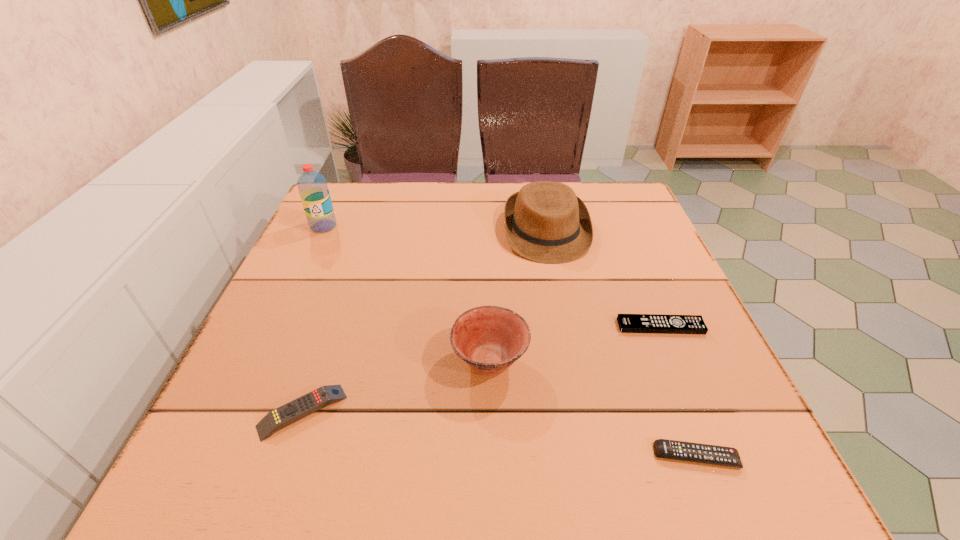
At what (x,y) coordinates should I click in order to perform the action: click on the tallest object. Please return your answer as a coordinate pair (x, y). Image resolution: width=960 pixels, height=540 pixels. Looking at the image, I should click on (312, 186).

Find the location of `the leftmost object`. the leftmost object is located at coordinates (312, 186).

Identify the location of the second tallest object. (545, 222).

Locate an element on the screen. The height and width of the screenshot is (540, 960). bowl is located at coordinates (489, 339).

Identify the location of the leftmost remote control. The width and height of the screenshot is (960, 540). (307, 404).

Find the location of a particular element. This screenshot has height=540, width=960. the fourth tallest object is located at coordinates (307, 404).

Find the location of a particular element. The width and height of the screenshot is (960, 540). the farthest remote control is located at coordinates (628, 323).

This screenshot has height=540, width=960. Identify the location of the nearest remote control. (669, 449).

Find the location of `free spot located on the front label of the leftmost object`. free spot located on the front label of the leftmost object is located at coordinates (310, 256).

The width and height of the screenshot is (960, 540). I want to click on vacant point located 0.390m on the front-facing side of the fedora, so click(581, 411).